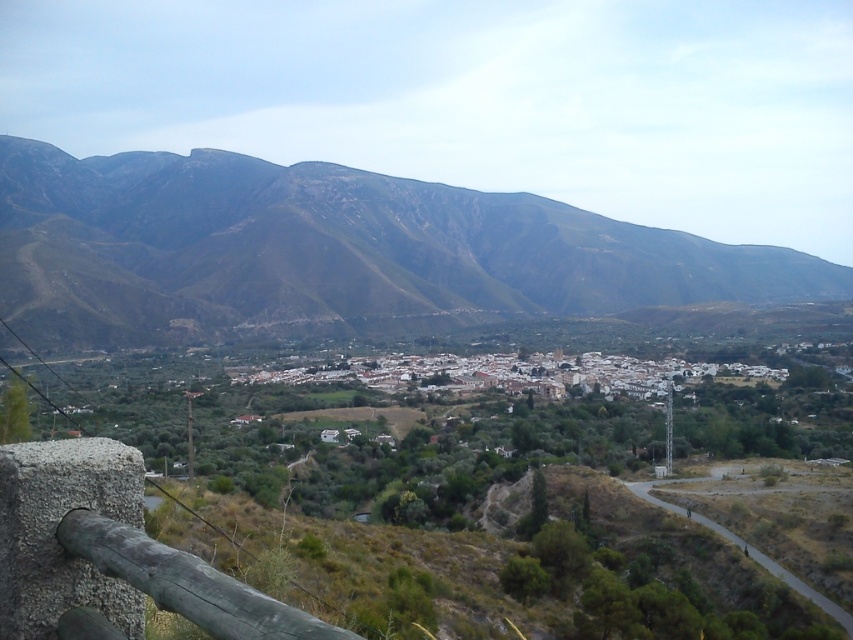
Is green textured mountain at upper left to the right of white matte town at center from the viewer's perspective?

No, green textured mountain at upper left is not to the right of white matte town at center.

Does green textured mountain at upper left have a greater height compared to white matte town at center?

Yes.

Locate an element on the screen. green textured mountain at upper left is located at coordinates (331, 250).

Is white matte town at center below weathered wood rail at lower left?

Indeed, white matte town at center is positioned under weathered wood rail at lower left.

Is point (524, 360) positioned after point (77, 554)?

Yes, it is behind point (77, 554).

Where is `white matte town at center`? The height and width of the screenshot is (640, 853). white matte town at center is located at coordinates (514, 372).

Between green textured mountain at upper left and weathered wood rail at lower left, which one has more height?

green textured mountain at upper left

Is green textured mountain at upper left to the right of weathered wood rail at lower left from the viewer's perspective?

Yes, green textured mountain at upper left is to the right of weathered wood rail at lower left.

Between point (157, 220) and point (123, 561), which one is positioned behind?

Point (157, 220)

Identify the location of green textured mountain at upper left. The width and height of the screenshot is (853, 640). (331, 250).